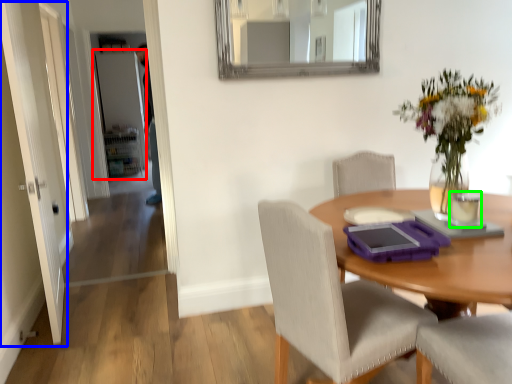
Question: Based on their relative distances, which object is nearer to door (highlighted by a red box)? Choose from door (highlighted by a blue box) and coffee cup (highlighted by a green box).

Choices:
 (A) door
 (B) coffee cup

Answer: (A)